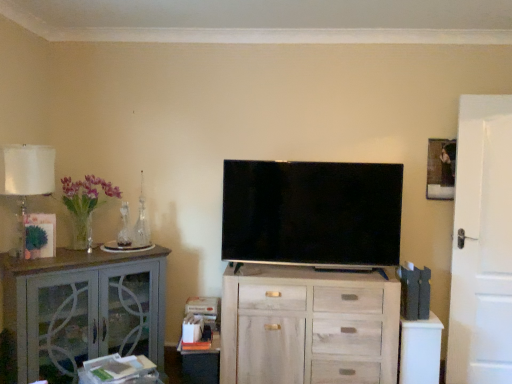
What is the approximate height of matte black tv at center?

matte black tv at center is 28.21 inches tall.

This screenshot has width=512, height=384. I want to click on matte gray cabinet at left, so click(x=82, y=310).

Identify the location of flower located in front of the clear glass vase at left. This screenshot has width=512, height=384. (85, 205).

Is clear glass vase at left oriented towards translucent glass vase at left?

No.

Based on the photo, does clear glass vase at left have a smaller size compared to translucent glass vase at left?

Correct, clear glass vase at left occupies less space than translucent glass vase at left.

From the image's perspective, which is above, clear glass vase at left or translucent glass vase at left?

translucent glass vase at left appears higher in the image.

Is matte gray cabinet at left to the left or to the right of white matte door at right in the image?

Clearly, matte gray cabinet at left is on the left of white matte door at right in the image.

From a real-world perspective, which is physically below, matte gray cabinet at left or white matte door at right?

matte gray cabinet at left is physically lower.

The height and width of the screenshot is (384, 512). What are the coordinates of `cabinetry that is on the left side of white matte door at right` in the screenshot? It's located at (82, 310).

Which of these two, matte gray cabinet at left or white matte door at right, is smaller?

With smaller size is white matte door at right.

Does point (477, 207) lie behind point (436, 175)?

That is False.

Can you tell me how much white matte door at right and wooden picture frame at upper right differ in facing direction?

There is a 3.99-degree angle between the facing directions of white matte door at right and wooden picture frame at upper right.

From a real-world perspective, is white matte door at right physically below wooden picture frame at upper right?

Yes, from a real-world perspective, white matte door at right is below wooden picture frame at upper right.

Where is `door below the wooden picture frame at upper right (from the image's perspective)`? The image size is (512, 384). door below the wooden picture frame at upper right (from the image's perspective) is located at coordinates (482, 244).

Is translucent glass table lamp at left shorter than clear glass vase at left?

In fact, translucent glass table lamp at left may be taller than clear glass vase at left.

Which of these two, translucent glass table lamp at left or clear glass vase at left, is wider?

Wider between the two is translucent glass table lamp at left.

From a real-world perspective, is translucent glass table lamp at left under clear glass vase at left?

Actually, translucent glass table lamp at left is physically above clear glass vase at left in the real world.

What's the angular difference between translucent glass table lamp at left and clear glass vase at left's facing directions?

The facing directions of translucent glass table lamp at left and clear glass vase at left are 0.00166 degrees apart.

Is wooden picture frame at upper right positioned far away from white wood cabinet at lower right?

Yes, wooden picture frame at upper right and white wood cabinet at lower right are located far from each other.

Is wooden picture frame at upper right oriented towards white wood cabinet at lower right?

No, wooden picture frame at upper right is not aimed at white wood cabinet at lower right.

In the scene shown: What's the angular difference between wooden picture frame at upper right and white wood cabinet at lower right's facing directions?

There is a 0.00399-degree angle between the facing directions of wooden picture frame at upper right and white wood cabinet at lower right.

Which of these two, wooden picture frame at upper right or white wood cabinet at lower right, is thinner?

wooden picture frame at upper right is thinner.

From a real-world perspective, between matte black tv at center and translucent glass vase at left, who is vertically lower?

In real-world perspective, matte black tv at center is lower.

Consider the image. Is matte black tv at center behind translucent glass vase at left?

Yes, matte black tv at center is behind translucent glass vase at left.

Does matte black tv at center have a lesser height compared to translucent glass vase at left?

In fact, matte black tv at center may be taller than translucent glass vase at left.

In terms of size, does matte black tv at center appear bigger or smaller than translucent glass vase at left?

matte black tv at center is bigger than translucent glass vase at left.

Between white matte door at right and clear glass vase at left, which one has smaller width?

Thinner between the two is white matte door at right.

Which object is positioned more to the left, white matte door at right or clear glass vase at left?

Positioned to the left is clear glass vase at left.

Which is behind, white matte door at right or clear glass vase at left?

clear glass vase at left is further from the camera.

Is white matte door at right looking in the opposite direction of clear glass vase at left?

No, clear glass vase at left is not at the back of white matte door at right.

This screenshot has height=384, width=512. I want to click on vase below the translucent glass vase at left (from a real-world perspective), so click(141, 226).

Identify the location of door located behind the matte gray cabinet at left. Image resolution: width=512 pixels, height=384 pixels. (482, 244).

Estimate the real-world distances between objects in this image. Which object is closer to translucent glass vase at left, matte black tv at center or white wood chest of drawers at center?

→ The object closer to translucent glass vase at left is matte black tv at center.

Looking at this image, considering their positions, is white wood cabinet at lower right positioned further to translucent glass vase at left than white wood chest of drawers at center?

white wood cabinet at lower right lies further to translucent glass vase at left than the other object.

From the image, which object appears to be farther from wooden picture frame at upper right, matte black tv at center or clear glass vase at left?

clear glass vase at left is positioned further to the anchor wooden picture frame at upper right.

From the image, which object appears to be farther from white matte door at right, translucent glass vase at left or matte black tv at center?

Based on the image, translucent glass vase at left appears to be further to white matte door at right.

From the picture: From the image, which object appears to be nearer to matte black tv at center, white wood chest of drawers at center or clear glass vase at left?

Based on the image, white wood chest of drawers at center appears to be nearer to matte black tv at center.

Looking at the image, which one is located further to white matte door at right, wooden picture frame at upper right or clear glass vase at left?

→ Among the two, clear glass vase at left is located further to white matte door at right.

Considering their positions, is white wood chest of drawers at center positioned further to white matte door at right than clear glass vase at left?

clear glass vase at left is positioned further to the anchor white matte door at right.

From the image, which object appears to be farther from translucent glass vase at left, white wood chest of drawers at center or matte black tv at center?

The object further to translucent glass vase at left is white wood chest of drawers at center.

Where is `flower between translucent glass table lamp at left and white wood chest of drawers at center`? The image size is (512, 384). flower between translucent glass table lamp at left and white wood chest of drawers at center is located at coordinates (85, 205).

Locate an element on the screen. The height and width of the screenshot is (384, 512). table between matte gray cabinet at left and wooden picture frame at upper right is located at coordinates (420, 350).

Locate an element on the screen. Image resolution: width=512 pixels, height=384 pixels. television located between translucent glass vase at left and white matte door at right in the left-right direction is located at coordinates (312, 213).

Locate an element on the screen. The height and width of the screenshot is (384, 512). flower between translucent glass table lamp at left and white wood cabinet at lower right is located at coordinates (85, 205).